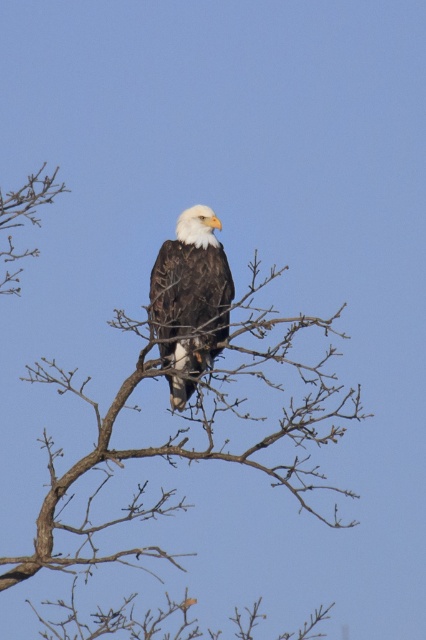
Does point (305, 406) lie in front of point (180, 237)?

Yes, it is.

I want to click on brown wood tree branch at center, so click(x=181, y=445).

Is point (203, 305) farther from camera compared to point (178, 227)?

That is False.

Identify the location of brown wood tree branch at center. click(181, 445).